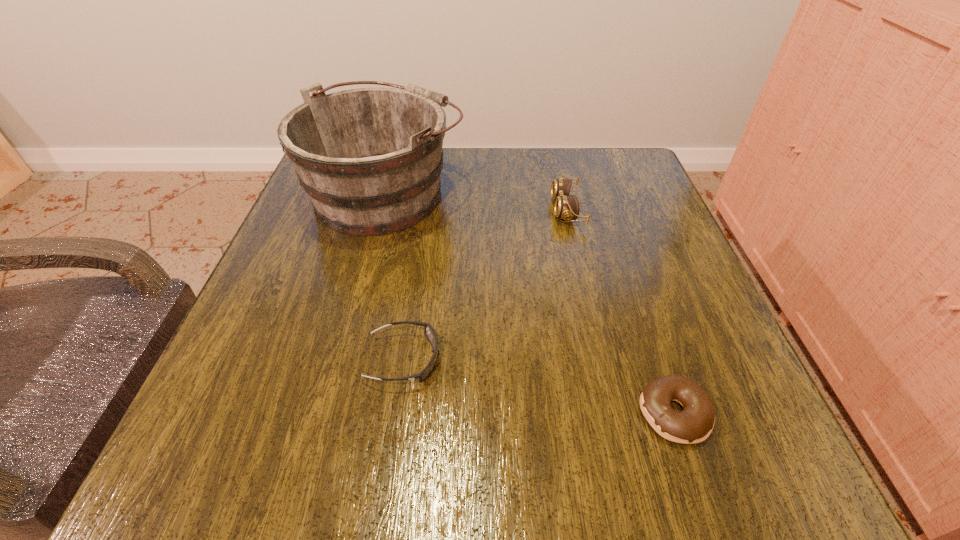
You are a GUI agent. You are given a task and a screenshot of the screen. Output one action in this format:
    pyautogui.click(x=<x>, y=<y>)
    Task: Click on the tallest object
    This screenshot has height=540, width=960.
    Given the screenshot: What is the action you would take?
    pyautogui.click(x=370, y=159)

I want to click on the taller goggles, so click(x=566, y=207).

Where is `the third shortest object`? the third shortest object is located at coordinates (566, 207).

Where is `the left goggles`? the left goggles is located at coordinates (430, 333).

This screenshot has width=960, height=540. In order to click on the shorter goggles in this screenshot , I will do `click(430, 333)`.

At what (x,y) coordinates should I click in order to perform the action: click on the rightmost object. Please return your answer as a coordinate pair (x, y). The image size is (960, 540). Looking at the image, I should click on (694, 424).

Locate an element on the screen. This screenshot has width=960, height=540. vacant point located 0.300m on the right of the wine bucket is located at coordinates (598, 192).

Where is `vacant space located through the lenses of the third object from left to right`? Image resolution: width=960 pixels, height=540 pixels. vacant space located through the lenses of the third object from left to right is located at coordinates (510, 210).

Find the location of a particular element. The image size is (960, 540). blank space located 0.080m through the lenses of the third object from left to right is located at coordinates (515, 210).

The image size is (960, 540). Identify the location of vacant point located 0.240m through the lenses of the third object from left to right. (441, 210).